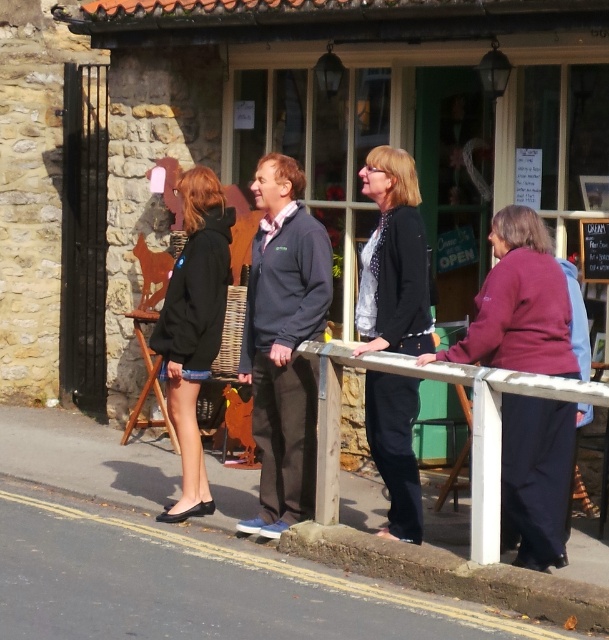
You are a photographer trying to capture both the black fabric jacket at center and the black matte jacket at left in a single shot. Which jacket will appear larger in the photo?

The black fabric jacket at center will appear larger in the photo because it is closer to the viewer than the black matte jacket at left.

In the scene shown: You are standing at the camera position and want to walk to point (396,435). Is the distance more than 30 feet?

Yes, the distance between the camera and point (396,435) is 32.90 feet, which is more than 30 feet.

You are standing on the street and want to approach the black fabric jacket at center and the concrete curb at lower center. Which object is closer to your right side when facing the building?

The concrete curb at lower center is closer to your right side because the black fabric jacket at center is positioned to its left.